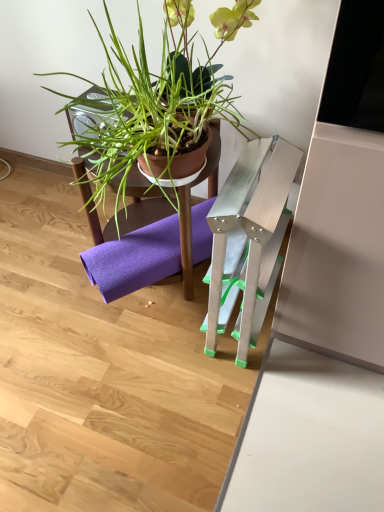
This screenshot has height=512, width=384. Find the location of `vacant space to the left of brown matte plant pot at upper center`. vacant space to the left of brown matte plant pot at upper center is located at coordinates (50, 269).